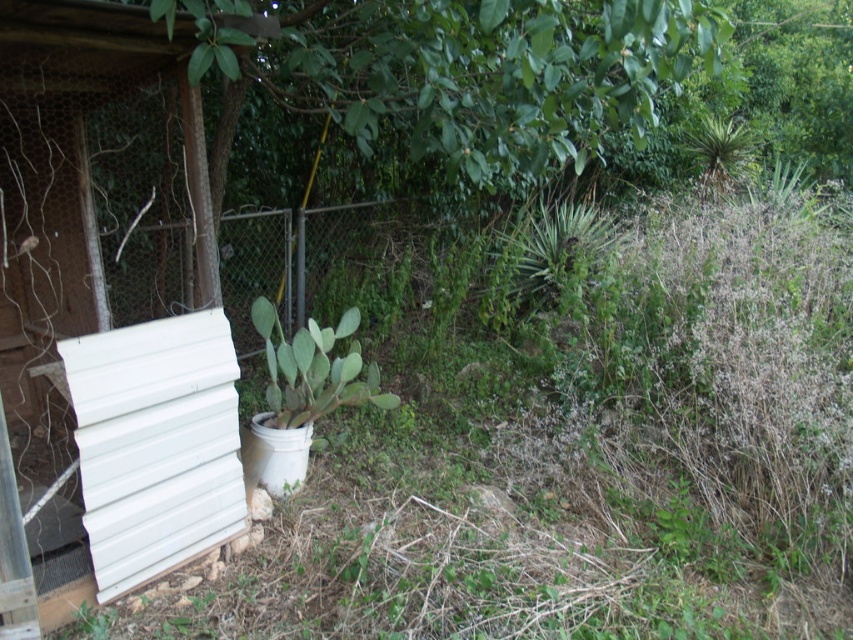
You are standing at the center of the image and want to move towards the white corrugated metal hut at left. Which direction should you face to walk directly towards it?

You should face towards the left direction to walk directly towards the white corrugated metal hut at left since it is located on the left side of the image.

You are standing in the backyard and want to place a new plant between the two points marked as point (19, 156) and point (442, 234). Which point should you start closer to to ensure the plant is closer to the viewer?

You should start closer to point (19, 156) because it is closer to the viewer than point (442, 234).